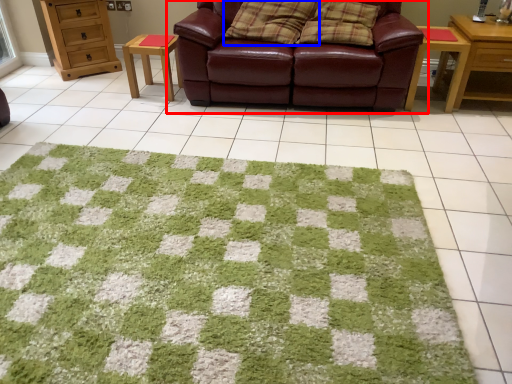
Question: Which object appears farthest to the camera in this image, studio couch (highlighted by a red box) or pillow (highlighted by a blue box)?

Choices:
 (A) studio couch
 (B) pillow

Answer: (B)